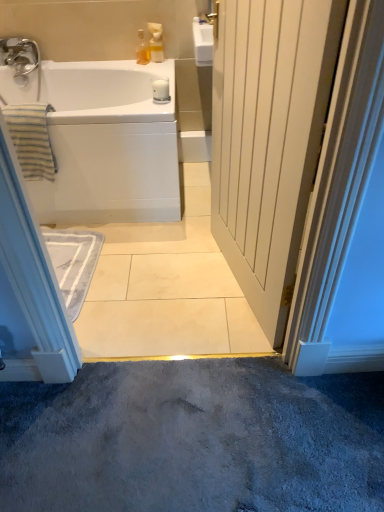
This screenshot has width=384, height=512. I want to click on free space that is to the left of white wood door at center, so click(x=170, y=281).